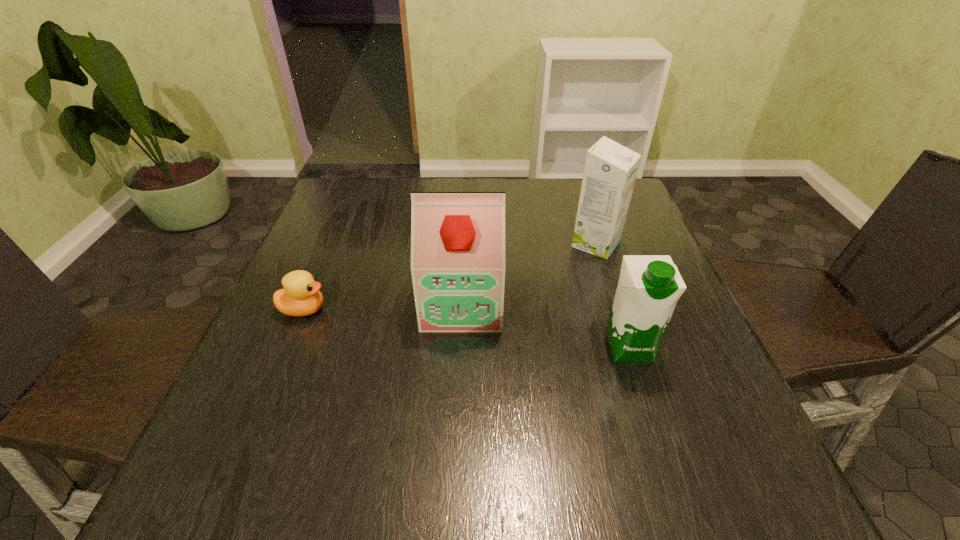
This screenshot has height=540, width=960. I want to click on blank space located on the face of the duckling, so click(x=510, y=310).

In order to click on object that is at the left edge in this screenshot , I will do `click(300, 297)`.

I want to click on carton that is at the right edge, so click(610, 171).

Image resolution: width=960 pixels, height=540 pixels. Find the location of `soya milk present at the right edge`. soya milk present at the right edge is located at coordinates (649, 286).

What are the coordinates of `vacant space at the far edge` in the screenshot? It's located at (564, 207).

This screenshot has height=540, width=960. Identify the location of free space at the near edge of the desktop. (465, 463).

Identify the location of free space at the left edge of the desktop. (351, 237).

Identify the location of vacant space at the right edge of the desktop. (727, 384).

This screenshot has height=540, width=960. What are the coordinates of `vacant region at the far left corner of the desktop` in the screenshot? It's located at (337, 191).

This screenshot has height=540, width=960. What are the coordinates of `free space that is in between the shorter soya milk and the taller soya milk` in the screenshot? It's located at (545, 325).